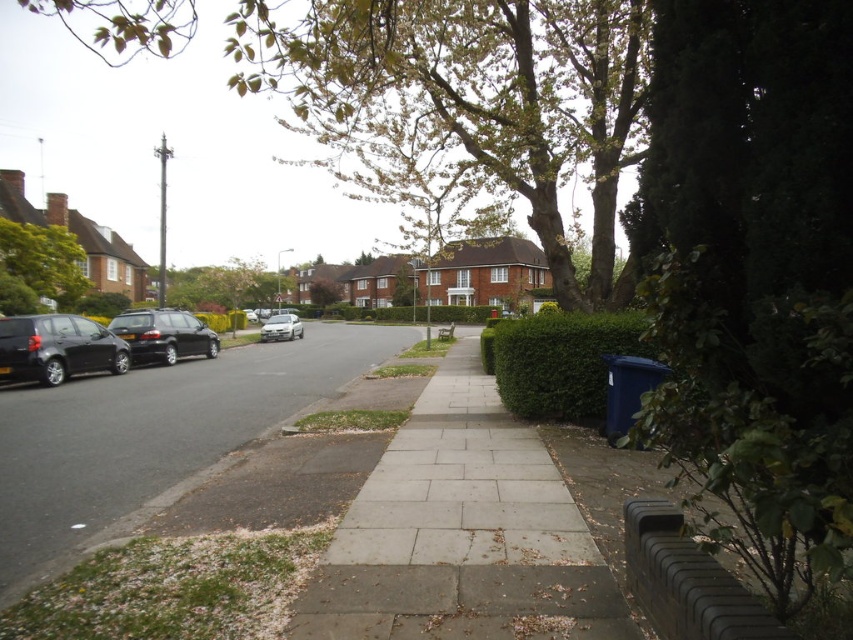
Question: Is black rubber curb at lower right wider than green leafy tree at upper left?

Choices:
 (A) no
 (B) yes

Answer: (A)

Question: Estimate the real-world distances between objects in this image. Which object is closer to the green leafy tree at right?

Choices:
 (A) matte black car at left
 (B) gray concrete sidewalk at lower left
 (C) green leafy tree at center

Answer: (B)

Question: Does black rubber curb at lower right appear on the left side of shiny black car at left?

Choices:
 (A) yes
 (B) no

Answer: (B)

Question: Which point is closer to the camera?

Choices:
 (A) green leafy hedge at right
 (B) shiny black car at left
 (C) green leafy tree at upper center

Answer: (C)

Question: Which object is positioned closest to the brown textured tree at center?

Choices:
 (A) gray concrete sidewalk at center
 (B) satin silver car at center
 (C) green leafy hedge at right
 (D) green leafy tree at center

Answer: (D)

Question: Does gray concrete sidewalk at lower left lie in front of satin silver car at center?

Choices:
 (A) yes
 (B) no

Answer: (A)